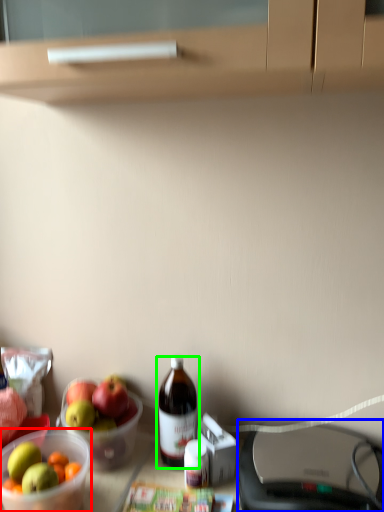
Question: Estimate the real-world distances between objects in this image. Which object is farther from bowl (highlighted by a red box), wide (highlighted by a blue box) or bottle (highlighted by a green box)?

Choices:
 (A) wide
 (B) bottle

Answer: (A)